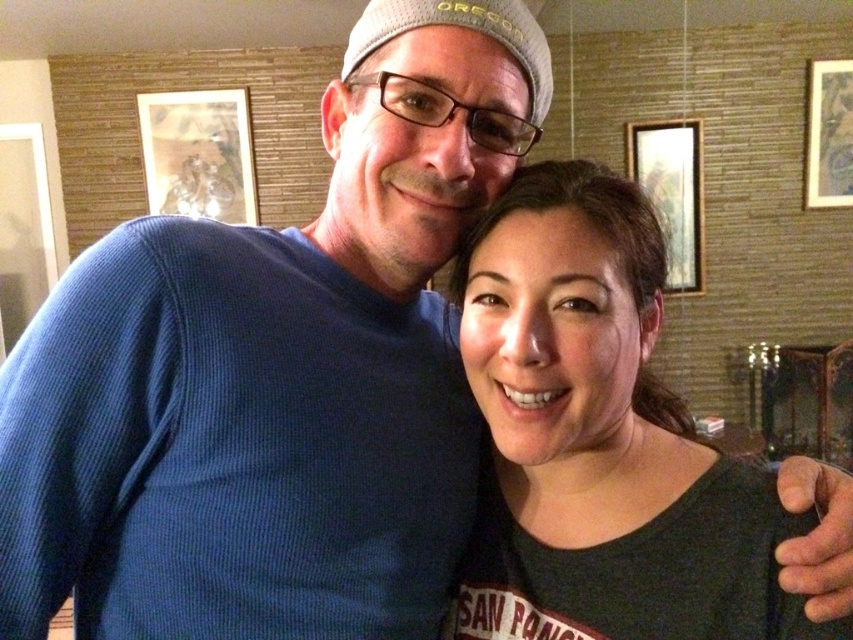
Question: Does dark gray t-shirt at center appear under wooden picture frame at upper right?

Choices:
 (A) yes
 (B) no

Answer: (A)

Question: Considering the relative positions of dark gray t-shirt at center and wooden frame at upper left in the image provided, where is dark gray t-shirt at center located with respect to wooden frame at upper left?

Choices:
 (A) above
 (B) below

Answer: (B)

Question: Which object is farther from the camera taking this photo?

Choices:
 (A) wooden frame at upper left
 (B) dark gray t-shirt at center
 (C) wooden picture frame at upper right

Answer: (C)

Question: In this image, where is dark gray t-shirt at center located relative to wooden picture frame at upper right?

Choices:
 (A) left
 (B) right

Answer: (A)

Question: Which is nearer to the dark gray t-shirt at center?

Choices:
 (A) wooden framed artwork at upper right
 (B) wooden picture frame at upper right

Answer: (A)

Question: Which point is farther to the camera?

Choices:
 (A) wooden framed artwork at upper right
 (B) dark gray t-shirt at center
 (C) wooden frame at upper left
 (D) wooden picture frame at upper right

Answer: (D)